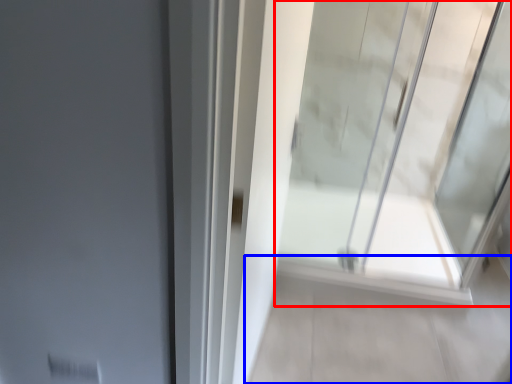
Question: Which of the following is the closest to the observer, window (highlighted by a red box) or path (highlighted by a blue box)?

Choices:
 (A) window
 (B) path

Answer: (A)